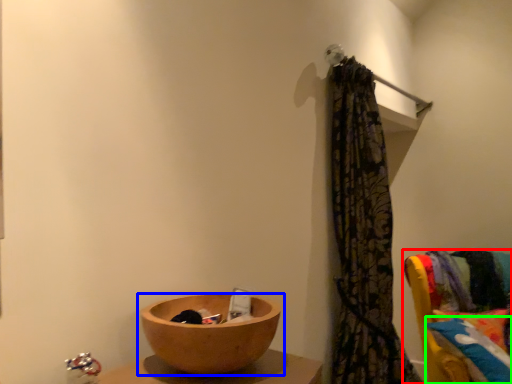
Question: Based on their relative distances, which object is nearer to furniture (highlighted by a red box)? Choose from tableware (highlighted by a blue box) and pillow (highlighted by a green box).

Choices:
 (A) tableware
 (B) pillow

Answer: (B)